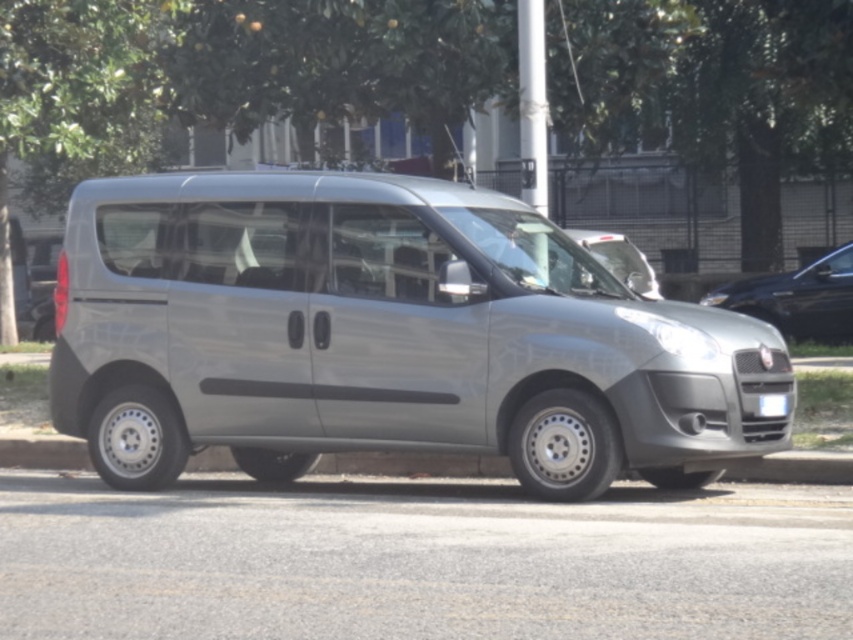
You are a delivery driver who needs to park your van in a parking spot that is 6 meters long. You see the green leafy tree at upper center and the silver metallic van at center. Can you determine if the parking space between them is long enough to park your van?

The distance between the green leafy tree at upper center and the silver metallic van at center is 5.55 meters. Since the parking space is only 5.55 meters long and your van requires a 6 meter long spot, the space is too short for your van.

You are a delivery driver who needs to park your vehicle in a parking spot that is exactly 2 meters wide. Your current vehicle is the satin silver van at center. The white plastic license plate at center is attached to the back of the van. Can you determine if your van will fit in the parking spot based on their positions?

The satin silver van at center is positioned on the left side of the white plastic license plate at center. Since the license plate is attached to the back of the van, the van itself must be longer than the distance between its left side and the license plate. However, without knowing the exact length of the van or the distance between the two, it is impossible to determine if it will fit in a 2 meter wide parking spot.

You are standing at the point marked by the coordinates point (230, 76) in the image. Looking around, you see the silver Fiat Doblo parked on the side of the road and the green leafy tree at upper center. Which direction should you walk to reach the silver Fiat Doblo?

The point (230, 76) is at the green leafy tree at upper center. To reach the silver Fiat Doblo parked on the side of the road, you should walk downward from the tree since the car is positioned lower in the image compared to the tree.